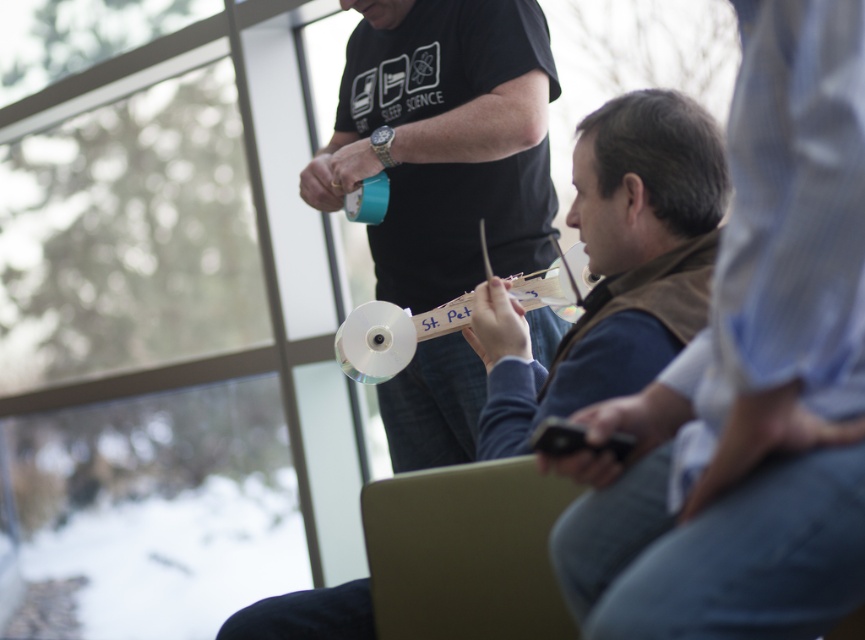
Question: Can you confirm if blue denim jeans at center is thinner than matte white cd at center?

Choices:
 (A) no
 (B) yes

Answer: (B)

Question: Which point is farther to the camera?

Choices:
 (A) (460, 49)
 (B) (581, 358)
 (C) (555, 531)

Answer: (A)

Question: Which is nearer to the blue denim jeans at center?

Choices:
 (A) matte black t-shirt at center
 (B) matte white cd at center

Answer: (B)

Question: Which point appears farthest from the camera in this image?

Choices:
 (A) (827, 564)
 (B) (439, 432)

Answer: (B)

Question: Does blue denim jeans at center have a greater width compared to matte black t-shirt at center?

Choices:
 (A) yes
 (B) no

Answer: (B)

Question: Is matte black t-shirt at center closer to the viewer compared to matte white cd at center?

Choices:
 (A) yes
 (B) no

Answer: (B)